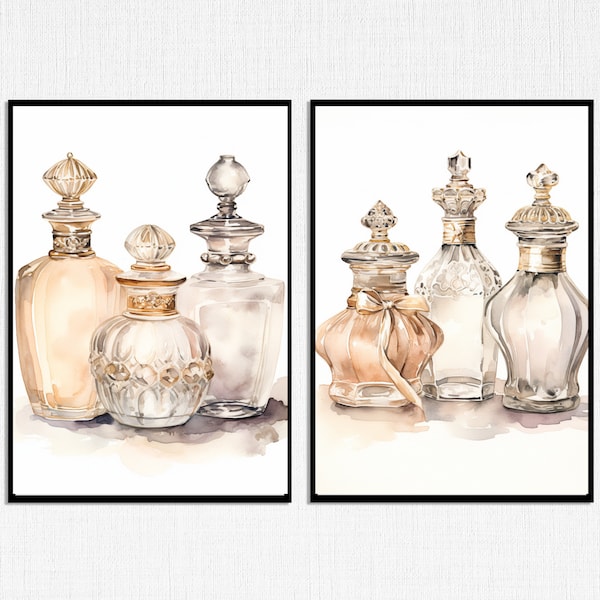
You are a GUI agent. You are given a task and a screenshot of the screen. Output one action in this format:
    pyautogui.click(x=<x>, y=<y>)
    Task: Click on the tall clear vase
    
    Given the screenshot: What is the action you would take?
    pyautogui.click(x=231, y=327)